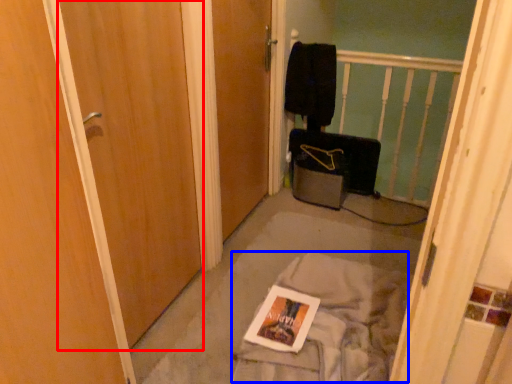
Question: Which point is further to the camera, door (highlighted by a red box) or trim (highlighted by a blue box)?

Choices:
 (A) door
 (B) trim

Answer: (B)